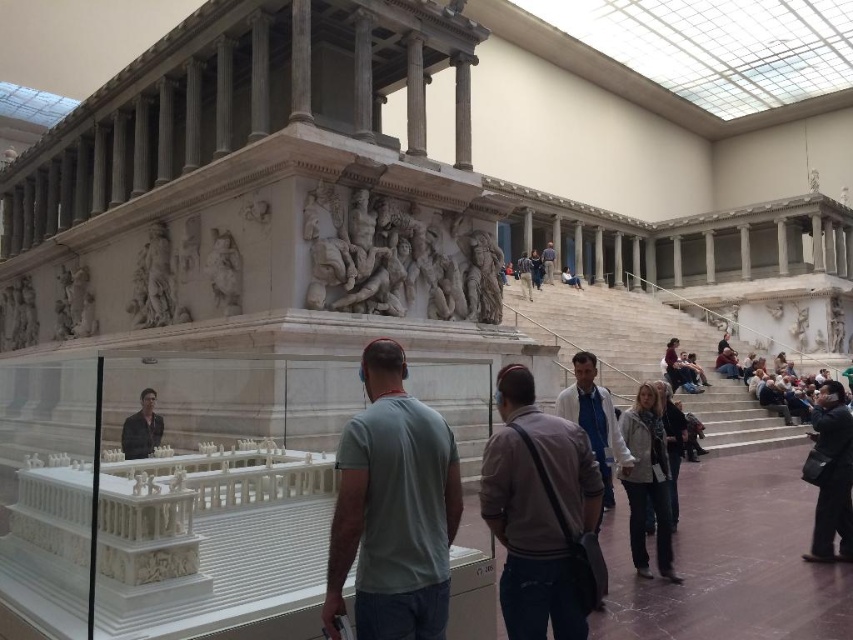
From the picture: You are a visitor standing in front of the Pergamon Altar replica in the museum. You notice a white marble statue at center and blue denim jeans at center. Which object takes up more space in the scene?

The blue denim jeans at center occupies more space than the white marble statue at center.

You are a visitor at the museum and want to take a photo of the Pergamon Altar replica. However, there is an obstruction blocking your view. Can you identify the object at the point with coordinates (833,476) that is blocking your shot?

The object at point (833,476) is a black leather jacket at lower right, which is likely the obstruction blocking your view of the Pergamon Altar replica.

You are a security guard in the museum and notice a black leather jacket at lower right and a white marble statue at center. You need to check if the jacket is within the 100 feet restricted zone around the statue. Is the jacket within the restricted zone?

The black leather jacket at lower right is 102.59 feet away from the white marble statue at center, so it is outside the 100 feet restricted zone.